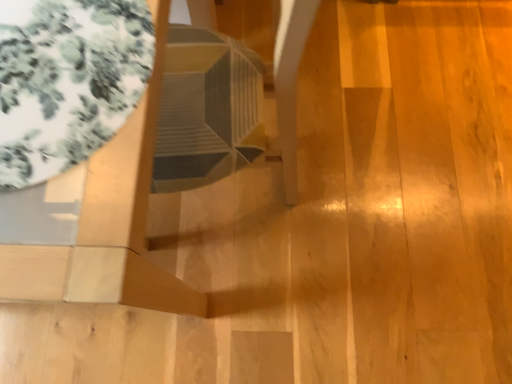
The height and width of the screenshot is (384, 512). Describe the element at coordinates (67, 81) in the screenshot. I see `transparent glass table at upper left` at that location.

In order to click on transparent glass table at upper left in this screenshot , I will do `click(67, 81)`.

What do you see at coordinates (106, 223) in the screenshot? I see `matte wood side table at upper left` at bounding box center [106, 223].

I want to click on matte wood side table at upper left, so click(x=106, y=223).

What are the coordinates of `transparent glass table at upper left` in the screenshot? It's located at (67, 81).

Can you confirm if matte wood side table at upper left is positioned to the left of transparent glass table at upper left?

Correct, you'll find matte wood side table at upper left to the left of transparent glass table at upper left.

Which object is further away from the camera, matte wood side table at upper left or transparent glass table at upper left?

transparent glass table at upper left.

Does point (149, 261) appear closer or farther from the camera than point (23, 10)?

Point (149, 261) is farther from the camera than point (23, 10).

From the image's perspective, is matte wood side table at upper left under transparent glass table at upper left?

Yes, from the image's perspective, matte wood side table at upper left is below transparent glass table at upper left.

From a real-world perspective, is matte wood side table at upper left above or below transparent glass table at upper left?

Clearly, from a real-world perspective, matte wood side table at upper left is below transparent glass table at upper left.

Consider the image. Considering the relative sizes of matte wood side table at upper left and transparent glass table at upper left in the image provided, is matte wood side table at upper left thinner than transparent glass table at upper left?

No, matte wood side table at upper left is not thinner than transparent glass table at upper left.

From their relative heights in the image, would you say matte wood side table at upper left is taller or shorter than transparent glass table at upper left?

Considering their sizes, matte wood side table at upper left has more height than transparent glass table at upper left.

Considering the sizes of objects matte wood side table at upper left and transparent glass table at upper left in the image provided, who is smaller, matte wood side table at upper left or transparent glass table at upper left?

transparent glass table at upper left is smaller.

Is transparent glass table at upper left inside matte wood side table at upper left?

Yes, transparent glass table at upper left is a part of matte wood side table at upper left.

Is matte wood side table at upper left next to transparent glass table at upper left and touching it?

No, matte wood side table at upper left is not making contact with transparent glass table at upper left.

Is matte wood side table at upper left oriented towards transparent glass table at upper left?

No, matte wood side table at upper left is not oriented towards transparent glass table at upper left.

What's the angular difference between matte wood side table at upper left and transparent glass table at upper left's facing directions?

The facing directions of matte wood side table at upper left and transparent glass table at upper left are 1.26 degrees apart.

Looking at this image, measure the distance from matte wood side table at upper left to transparent glass table at upper left.

matte wood side table at upper left is 6.89 inches away from transparent glass table at upper left.

Where is `furniture located in front of the transparent glass table at upper left`? The width and height of the screenshot is (512, 384). furniture located in front of the transparent glass table at upper left is located at coordinates (106, 223).

From the picture: Is transparent glass table at upper left at the left side of matte wood side table at upper left?

No, transparent glass table at upper left is not to the left of matte wood side table at upper left.

Based on the photo, which object is closer to the camera, transparent glass table at upper left or matte wood side table at upper left?

matte wood side table at upper left is closer to the camera.

Which is behind, point (42, 0) or point (158, 99)?

Positioned behind is point (158, 99).

From the image's perspective, which is below, transparent glass table at upper left or matte wood side table at upper left?

matte wood side table at upper left appears lower in the image.

From a real-world perspective, is transparent glass table at upper left below matte wood side table at upper left?

No, from a real-world perspective, transparent glass table at upper left is not under matte wood side table at upper left.

Is transparent glass table at upper left thinner than matte wood side table at upper left?

Correct, the width of transparent glass table at upper left is less than that of matte wood side table at upper left.

Considering the relative sizes of transparent glass table at upper left and matte wood side table at upper left in the image provided, is transparent glass table at upper left shorter than matte wood side table at upper left?

Correct, transparent glass table at upper left is not as tall as matte wood side table at upper left.

Consider the image. Which of these two, transparent glass table at upper left or matte wood side table at upper left, is smaller?

transparent glass table at upper left.

Could matte wood side table at upper left be considered to be inside transparent glass table at upper left?

Actually, matte wood side table at upper left is outside transparent glass table at upper left.

Is the surface of transparent glass table at upper left in direct contact with matte wood side table at upper left?

There is a gap between transparent glass table at upper left and matte wood side table at upper left.

Is transparent glass table at upper left oriented away from matte wood side table at upper left?

Yes.

Can you tell me how much transparent glass table at upper left and matte wood side table at upper left differ in facing direction?

There is a 1.26-degree angle between the facing directions of transparent glass table at upper left and matte wood side table at upper left.

Measure the distance from transparent glass table at upper left to matte wood side table at upper left.

The distance of transparent glass table at upper left from matte wood side table at upper left is 6.89 inches.

Find the location of a particular element. This screenshot has height=384, width=512. furniture lying below the transparent glass table at upper left (from the image's perspective) is located at coordinates point(106,223).

Locate an element on the screen. Image resolution: width=512 pixels, height=384 pixels. furniture on the left of transparent glass table at upper left is located at coordinates (106, 223).

Find the location of a particular element. furniture below the transparent glass table at upper left (from a real-world perspective) is located at coordinates tap(106, 223).